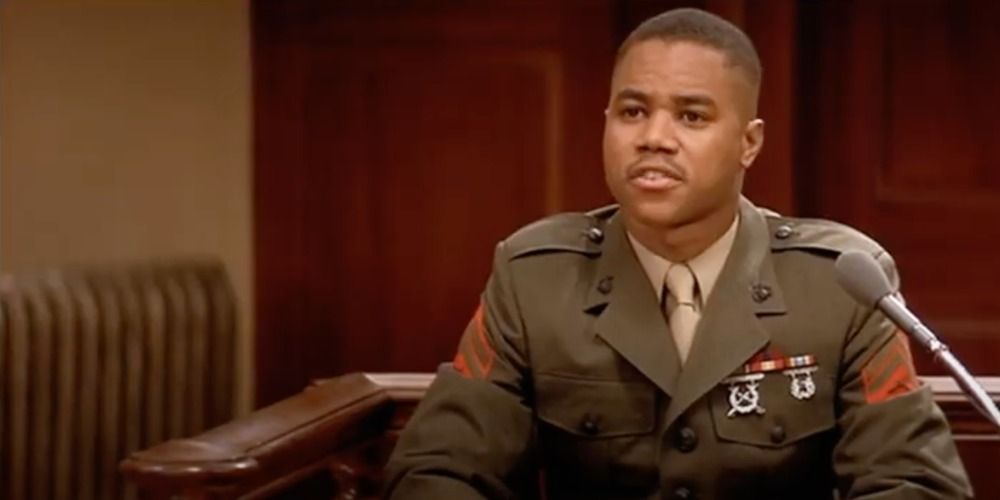
Find the location of `metallic silver radiator`. metallic silver radiator is located at coordinates (98, 368).